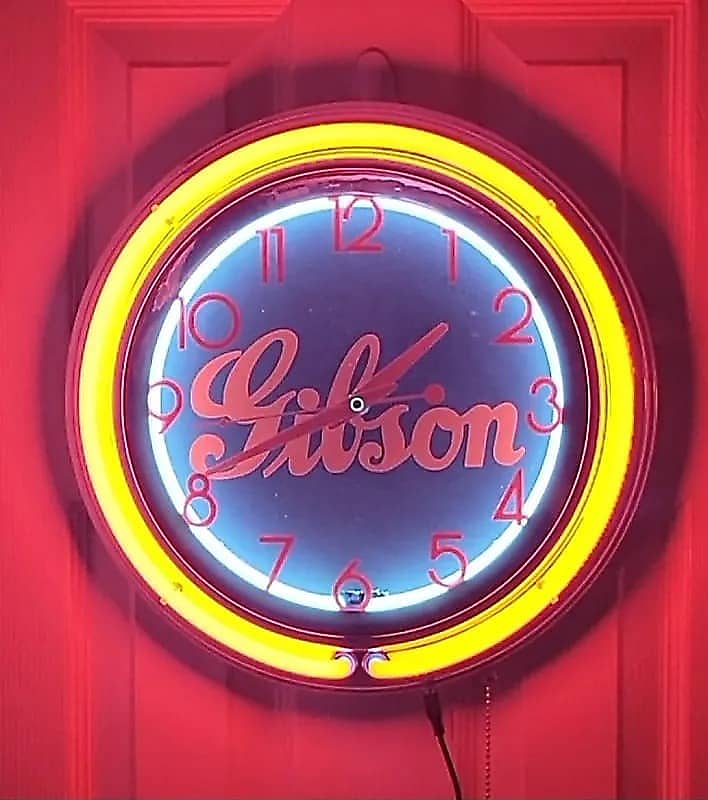
In order to click on short clock hand in this screenshot , I will do `click(416, 350)`.